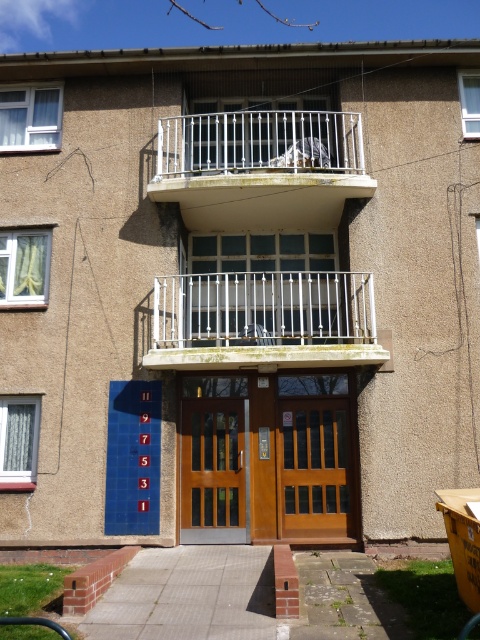
You are a delivery person trying to secure a package against the silver metallic railing at upper center. The wooden door at center is nearby. Considering their sizes, which object would be more suitable for placing the package?

The silver metallic railing at upper center has a larger width than the wooden door at center, making it more suitable for placing the package.